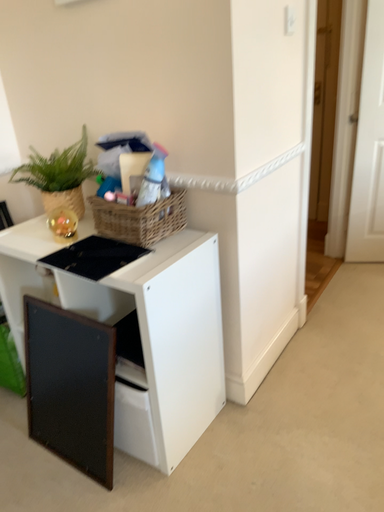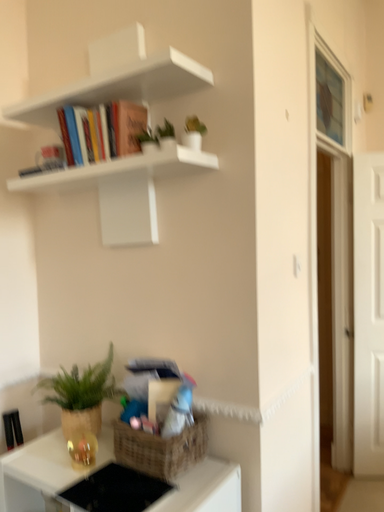
Question: Which way did the camera rotate in the video?

Choices:
 (A) rotated downward
 (B) rotated upward

Answer: (B)